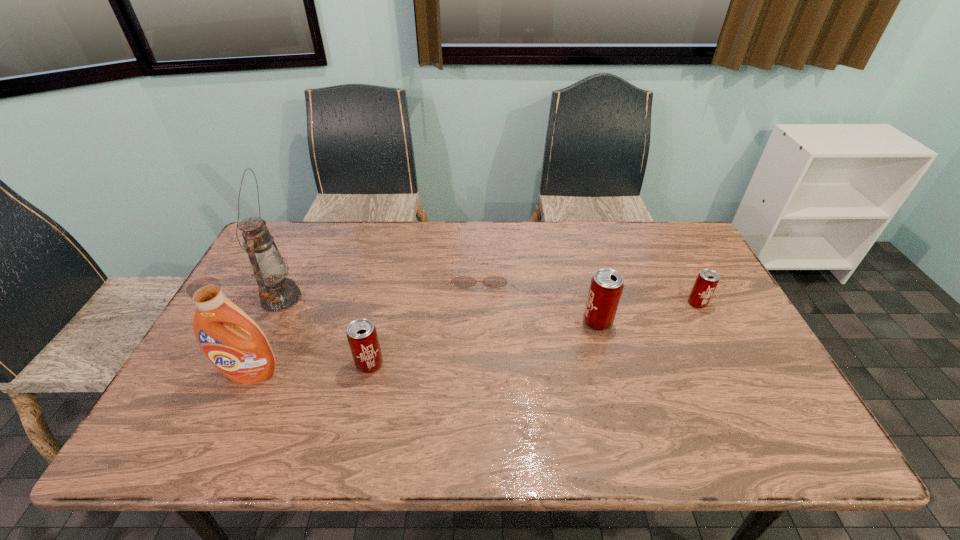
Locate an element on the screen. The image size is (960, 540). object situated at the right edge is located at coordinates (707, 280).

Find the location of a particular element. object that is at the near left corner is located at coordinates (233, 342).

Where is `vacant region at the far edge of the desktop`? This screenshot has height=540, width=960. vacant region at the far edge of the desktop is located at coordinates (488, 243).

Find the location of `free space at the near edge of the desktop`. free space at the near edge of the desktop is located at coordinates (645, 390).

The width and height of the screenshot is (960, 540). I want to click on free location at the right edge, so click(x=716, y=345).

The width and height of the screenshot is (960, 540). What are the coordinates of `vacant space at the far left corner` in the screenshot? It's located at (310, 244).

Where is `vacant point at the far right corner`? vacant point at the far right corner is located at coordinates (651, 242).

This screenshot has height=540, width=960. I want to click on empty space between the second beer can from left to right and the second tallest beer can, so click(x=484, y=343).

At what (x,y) coordinates should I click in order to perform the action: click on free space that is in between the second farthest beer can and the shortest beer can. Please return your answer as a coordinate pair (x, y). Looking at the image, I should click on (647, 312).

Where is `empty space between the second shortest object and the detergent`? This screenshot has width=960, height=540. empty space between the second shortest object and the detergent is located at coordinates (474, 338).